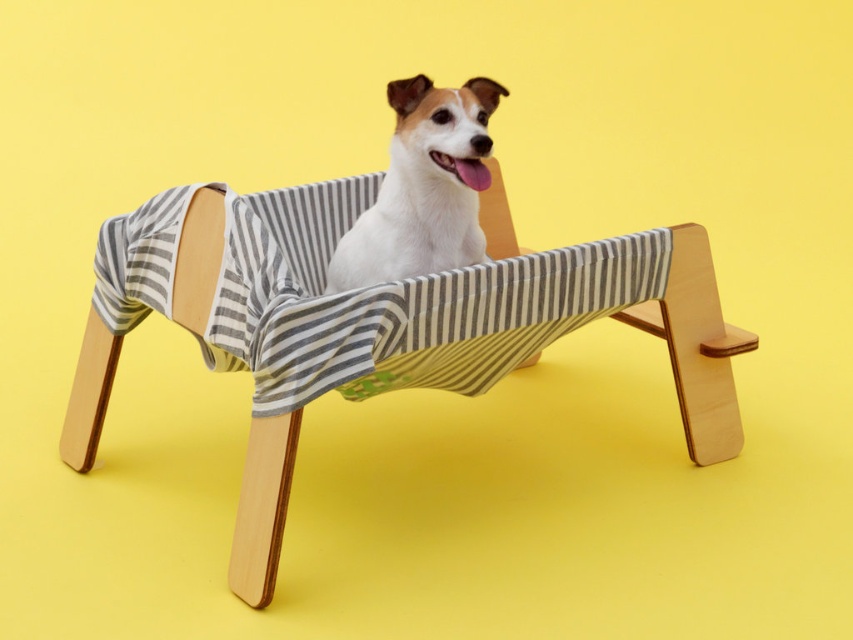
You are a pet owner who wants to place a new wooden striped beach chair at center in the room where your dog currently uses the white fabric dog bed at center. Considering the space between them, can you fit both items without them touching each other?

The distance between the wooden striped beach chair at center and white fabric dog bed at center is 12.84 inches, so yes, you can fit both items without them touching each other as there is enough space between them.

You are an interior designer planning to place a new sofa in a room. The sofa will be positioned such that it is directly to the left of the wooden striped beach chair at center. Given that the room has a coordinate system where the bottom left corner is the origin point, can you determine the approximate coordinates where the sofa should be placed?

The wooden striped beach chair at center is located at coordinates point (x=697, y=348). To place the sofa directly to the left, subtract a small value from the x coordinate. The sofa should be placed around point (x=697, y=284).

You are a photographer setting up a shoot in this scene. You have a wooden striped beach chair at center and a white fabric dog bed at center in your frame. Which object is positioned to the left side of the other?

The wooden striped beach chair at center is to the left of the white fabric dog bed at center.